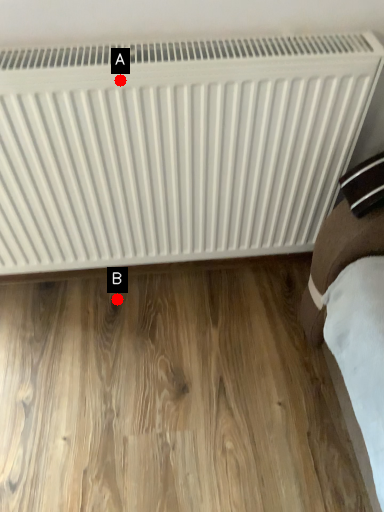
Question: Two points are circled on the image, labeled by A and B beside each circle. Which point is farther from the camera taking this photo?

Choices:
 (A) A is further
 (B) B is further

Answer: (B)